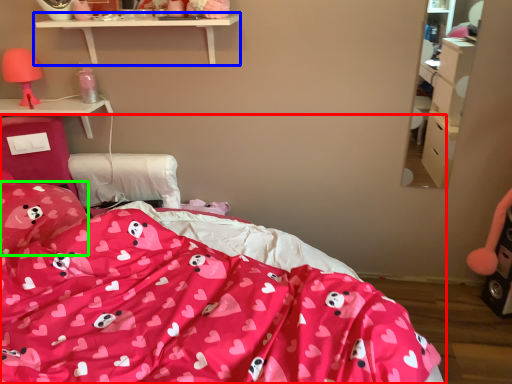
Question: Considering the real-world distances, which object is farthest from bed (highlighted by a red box)? shelf (highlighted by a blue box) or pillow (highlighted by a green box)?

Choices:
 (A) shelf
 (B) pillow

Answer: (A)